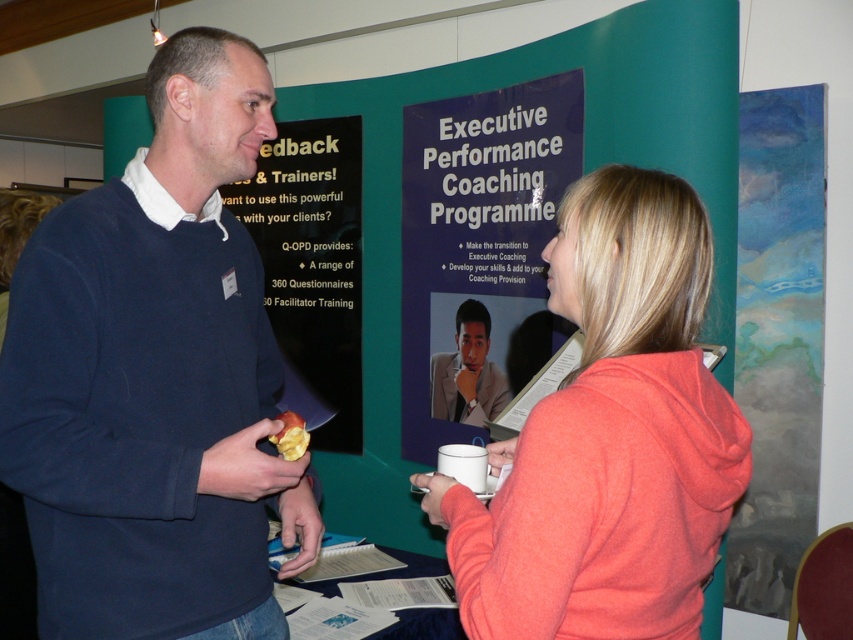
The width and height of the screenshot is (853, 640). Describe the element at coordinates (608, 436) in the screenshot. I see `coral fleece hoodie at upper right` at that location.

Is coral fleece hoodie at upper right taller than yellow matte apple at center?

Yes, coral fleece hoodie at upper right is taller than yellow matte apple at center.

What do you see at coordinates (608, 436) in the screenshot?
I see `coral fleece hoodie at upper right` at bounding box center [608, 436].

At what (x,y) coordinates should I click in order to perform the action: click on coral fleece hoodie at upper right. Please return your answer as a coordinate pair (x, y). The height and width of the screenshot is (640, 853). Looking at the image, I should click on (608, 436).

The height and width of the screenshot is (640, 853). Identify the location of dark blue sweater at center. (155, 378).

How much distance is there between dark blue sweater at center and light beige suit at center?

dark blue sweater at center is 4.89 feet from light beige suit at center.

The image size is (853, 640). Identify the location of dark blue sweater at center. (155, 378).

Can you confirm if dark blue sweater at center is thinner than watercolor painting at right?

No.

Can you confirm if dark blue sweater at center is shorter than watercolor painting at right?

Indeed, dark blue sweater at center has a lesser height compared to watercolor painting at right.

Which is behind, point (270, 627) or point (776, 253)?

The point (776, 253) is more distant.

Image resolution: width=853 pixels, height=640 pixels. I want to click on dark blue sweater at center, so click(155, 378).